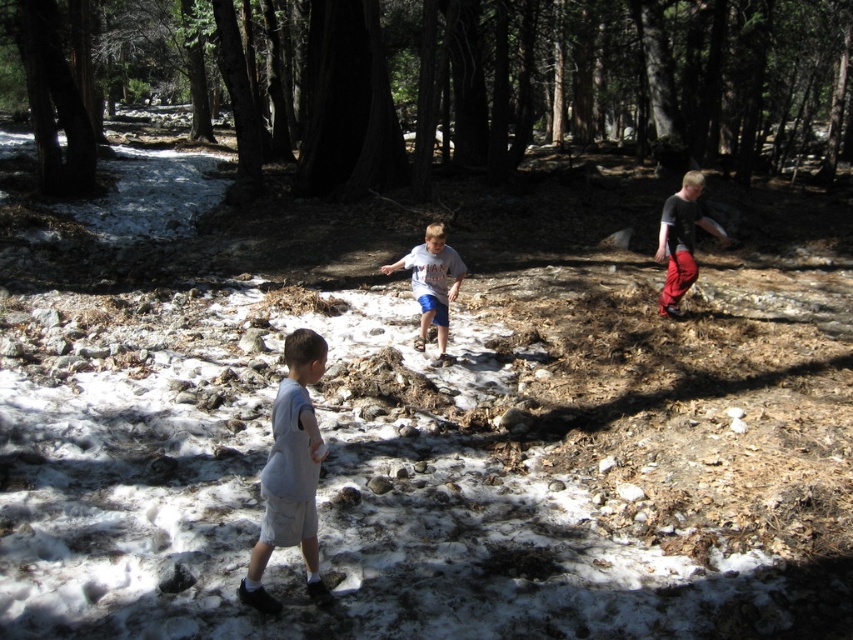
Question: Can you confirm if light gray cotton shorts at lower left is wider than dark gray shirt at right?

Choices:
 (A) no
 (B) yes

Answer: (B)

Question: Which point is farther from the camera taking this photo?

Choices:
 (A) (346, 19)
 (B) (698, 172)
 (C) (428, 252)
 (D) (286, 356)

Answer: (A)

Question: Which object is the farthest from the light gray cotton shorts at lower left?

Choices:
 (A) gray cotton shirt at center
 (B) brown rough tree at upper center
 (C) dark gray shirt at right

Answer: (B)

Question: Among these objects, which one is farthest from the camera?

Choices:
 (A) light gray cotton shorts at lower left
 (B) gray cotton shirt at center

Answer: (B)

Question: Does light gray cotton shorts at lower left have a smaller size compared to dark gray shirt at right?

Choices:
 (A) yes
 (B) no

Answer: (B)

Question: Is light gray cotton shorts at lower left to the left of gray cotton shirt at center from the viewer's perspective?

Choices:
 (A) no
 (B) yes

Answer: (B)